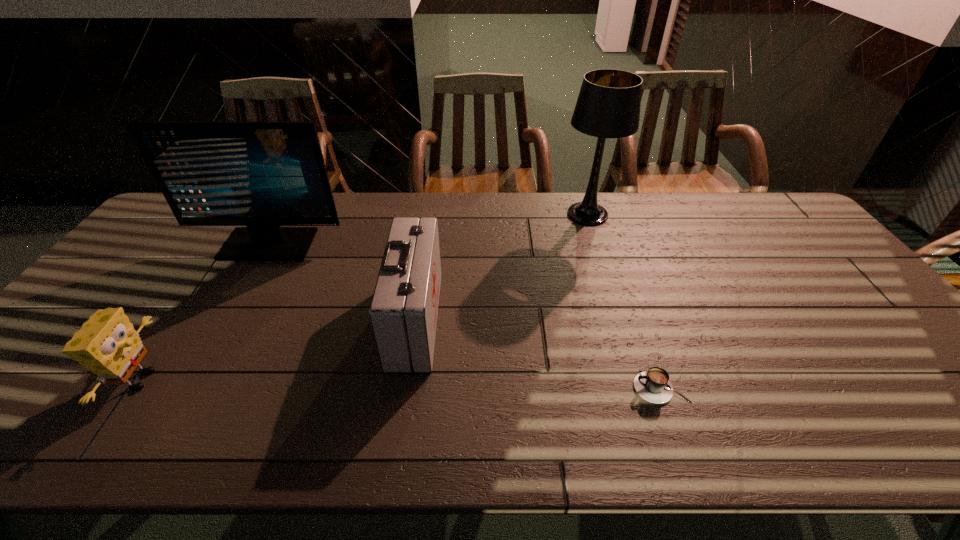
Find the location of a particular element. The image size is (960, 540). object identified as the second closest to the table lamp is located at coordinates (653, 385).

This screenshot has width=960, height=540. What are the coordinates of `vacant position in the image that satisfies the following two spatial constraints: 1. on the screen side of the monitor; 2. on the face of the second shortest object` in the screenshot? It's located at (191, 380).

Where is `free space that satisfies the following two spatial constraints: 1. on the screen side of the monitor; 2. on the face of the second shortest object`? This screenshot has height=540, width=960. free space that satisfies the following two spatial constraints: 1. on the screen side of the monitor; 2. on the face of the second shortest object is located at coordinates (191, 380).